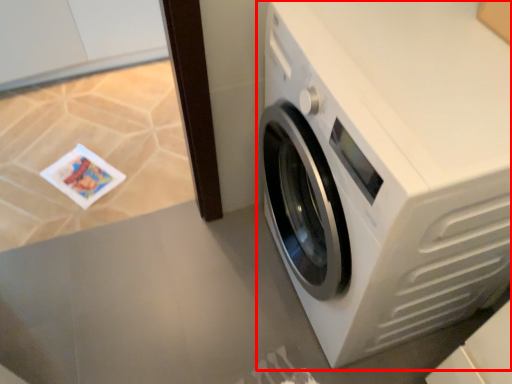
Question: From the image's perspective, what is the correct spatial positioning of washing machine (annotated by the red box) in reference to table top?

Choices:
 (A) below
 (B) above

Answer: (B)